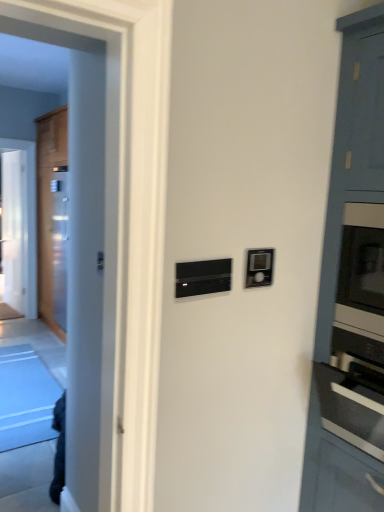
Find the location of a particular element. black matte thermostat at center is located at coordinates (203, 277).

What are the coordinates of `satin silver oven at right` in the screenshot? It's located at (342, 446).

What is the approximate width of transparent glass door at left?

4.49 inches.

Identify the location of black matte thermostat at center. This screenshot has width=384, height=512. (203, 277).

From a real-world perspective, is transparent glass door at left positioned under satin black thermostat at upper right based on gravity?

Yes, from a real-world perspective, transparent glass door at left is beneath satin black thermostat at upper right.

Is transparent glass door at left surrounding satin black thermostat at upper right?

Actually, satin black thermostat at upper right is outside transparent glass door at left.

What's the angular difference between transparent glass door at left and satin black thermostat at upper right's facing directions?

0.929 degrees separate the facing orientations of transparent glass door at left and satin black thermostat at upper right.

Between transparent glass door at left and satin black thermostat at upper right, which one has smaller width?

With smaller width is satin black thermostat at upper right.

Is transparent glass door at left a part of wooden door at left?

No, wooden door at left does not contain transparent glass door at left.

Between point (52, 212) and point (21, 240), which one is positioned behind?

Positioned behind is point (21, 240).

Is wooden door at left to the left of transparent glass door at left from the viewer's perspective?

Incorrect, wooden door at left is not on the left side of transparent glass door at left.

From their relative heights in the image, would you say wooden door at left is taller or shorter than transparent glass door at left?

In the image, wooden door at left appears to be taller than transparent glass door at left.

Is wooden door at left not near satin black thermostat at upper right?

Indeed, wooden door at left is not near satin black thermostat at upper right.

Is point (61, 113) positioned in front of point (247, 258)?

No, (61, 113) is further to viewer.

Find the location of `light switch in front of the wooden door at left`. light switch in front of the wooden door at left is located at coordinates (259, 267).

Is wooden door at left wider than satin black thermostat at upper right?

Correct, the width of wooden door at left exceeds that of satin black thermostat at upper right.

Does wooden door at left contain black matte thermostat at center?

No.

Is wooden door at left facing away from black matte thermostat at center?

No, black matte thermostat at center is not at the back of wooden door at left.

Consider the image. Can you confirm if wooden door at left is smaller than black matte thermostat at center?

No, wooden door at left is not smaller than black matte thermostat at center.

From the image's perspective, which one is positioned higher, wooden door at left or black matte thermostat at center?

wooden door at left.

In the image, is black matte thermostat at center on the left side or the right side of satin silver oven at right?

black matte thermostat at center is to the left of satin silver oven at right.

Is black matte thermostat at center wider or thinner than satin silver oven at right?

Clearly, black matte thermostat at center has less width compared to satin silver oven at right.

From a real-world perspective, which object stands above the other?

In real-world perspective, black matte thermostat at center is above.

Is satin silver oven at right positioned with its back to wooden door at left?

satin silver oven at right is not turned away from wooden door at left.

Is point (309, 488) less distant than point (58, 248)?

Yes, it is in front of point (58, 248).

Can you confirm if satin silver oven at right is wider than wooden door at left?

Yes.

Locate an element on the screen. This screenshot has width=384, height=512. door that is behind the satin silver oven at right is located at coordinates (51, 220).

The image size is (384, 512). What are the coordinates of `appliance that is in front of the transparent glass door at left` in the screenshot? It's located at (203, 277).

From the image's perspective, which one is positioned lower, black matte thermostat at center or transparent glass door at left?

From the image's view, black matte thermostat at center is below.

Looking at this image, considering the positions of objects black matte thermostat at center and transparent glass door at left in the image provided, who is more to the right, black matte thermostat at center or transparent glass door at left?

black matte thermostat at center.

Is black matte thermostat at center shorter than transparent glass door at left?

Indeed, black matte thermostat at center has a lesser height compared to transparent glass door at left.

Find the location of a particular element. light switch to the right of transparent glass door at left is located at coordinates (259, 267).

Where is `glass door located behind the wooden door at left`? glass door located behind the wooden door at left is located at coordinates (14, 228).

From the image, which object appears to be farther from satin black thermostat at upper right, transparent glass door at left or wooden door at left?

The object further to satin black thermostat at upper right is transparent glass door at left.

Based on their spatial positions, is transparent glass door at left or wooden door at left closer to satin silver oven at right?

wooden door at left is positioned closer to the anchor satin silver oven at right.

From the image, which object appears to be farther from black matte thermostat at center, satin silver oven at right or wooden door at left?

wooden door at left.

Estimate the real-world distances between objects in this image. Which object is further from satin black thermostat at upper right, transparent glass door at left or black matte thermostat at center?

Among the two, transparent glass door at left is located further to satin black thermostat at upper right.

Based on their spatial positions, is wooden door at left or transparent glass door at left closer to satin silver oven at right?

wooden door at left lies closer to satin silver oven at right than the other object.

Looking at the image, which one is located further to satin silver oven at right, black matte thermostat at center or satin black thermostat at upper right?

black matte thermostat at center is positioned further to the anchor satin silver oven at right.

In the scene shown: Considering their positions, is satin silver oven at right positioned closer to satin black thermostat at upper right than black matte thermostat at center?

black matte thermostat at center lies closer to satin black thermostat at upper right than the other object.

Estimate the real-world distances between objects in this image. Which object is further from transparent glass door at left, satin silver oven at right or wooden door at left?

Among the two, satin silver oven at right is located further to transparent glass door at left.

Where is `appliance between satin silver oven at right and transparent glass door at left along the z-axis`? This screenshot has height=512, width=384. appliance between satin silver oven at right and transparent glass door at left along the z-axis is located at coordinates (203, 277).

The height and width of the screenshot is (512, 384). I want to click on door located between black matte thermostat at center and transparent glass door at left in the depth direction, so click(51, 220).

The height and width of the screenshot is (512, 384). Identify the location of appliance between satin silver oven at right and wooden door at left in the front-back direction. (203, 277).

This screenshot has height=512, width=384. I want to click on light switch between black matte thermostat at center and wooden door at left along the z-axis, so click(x=259, y=267).